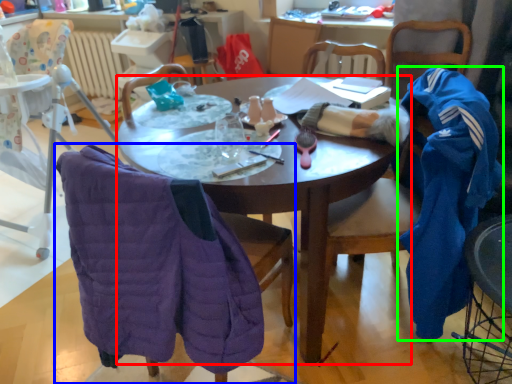
Question: Which object is positioned farthest from desk (highlighted by a red box)? Select from chair (highlighted by a blue box) and clothing (highlighted by a green box).

Choices:
 (A) chair
 (B) clothing

Answer: (B)